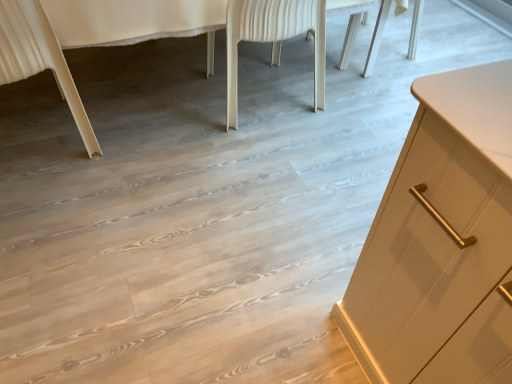
Find the location of a particular element. vacant space that's between white wood chair at center, marked as the 1th chair in a right-to-left arrangement, and light beige wood chair leg at lower left, placed as the 1th chair when sorted from left to right is located at coordinates (144, 114).